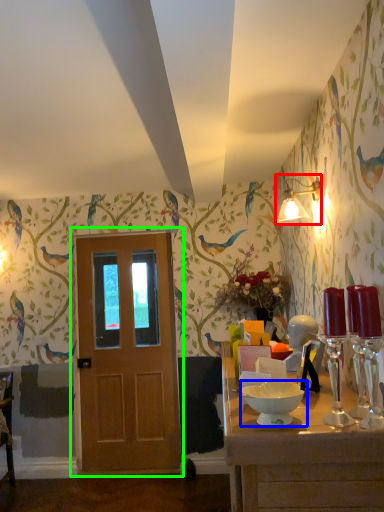
Question: Which object is the farthest from light fixture (highlighted by a red box)? Choose among these: bowl (highlighted by a blue box) or door (highlighted by a green box).

Choices:
 (A) bowl
 (B) door

Answer: (A)